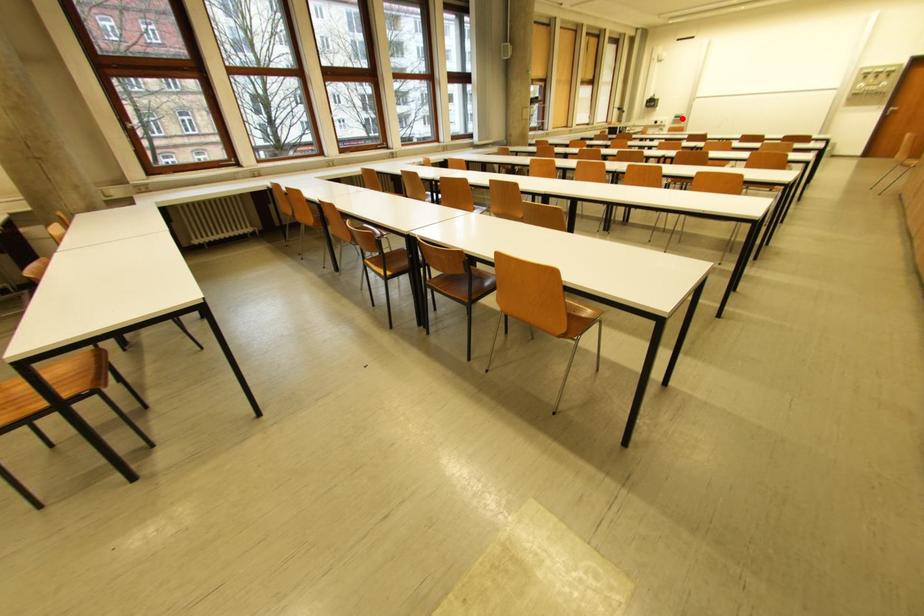
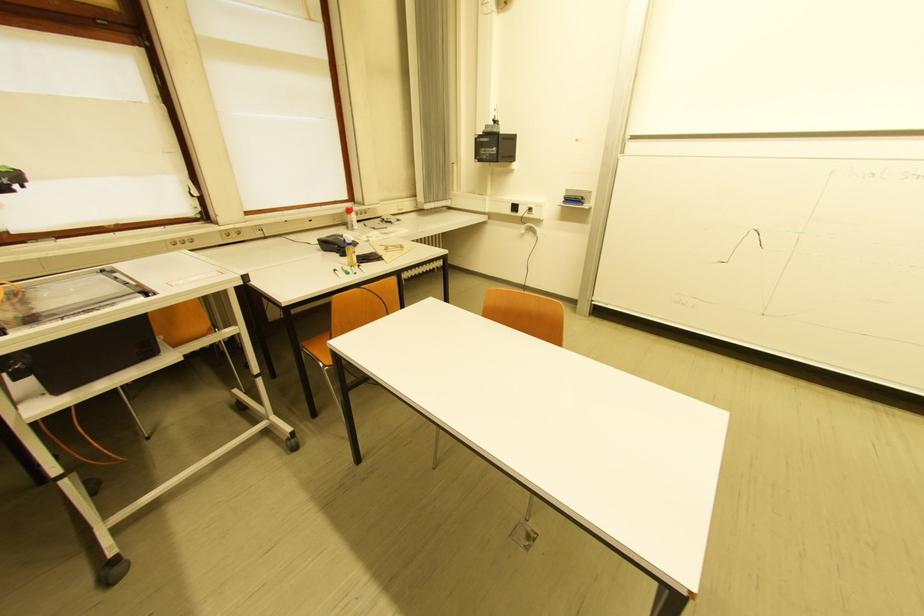
Question: I am providing you with two images of the same scene from different viewpoints. Given a red point in image1, look at the same physical point in image2. Is it:

Choices:
 (A) Closer to the viewpoint
 (B) Farther from the viewpoint

Answer: (A)